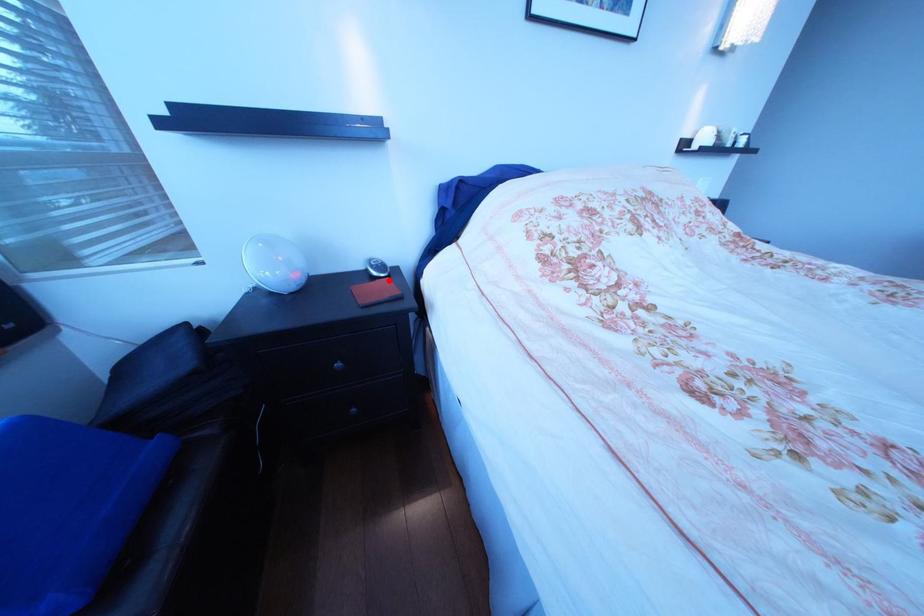
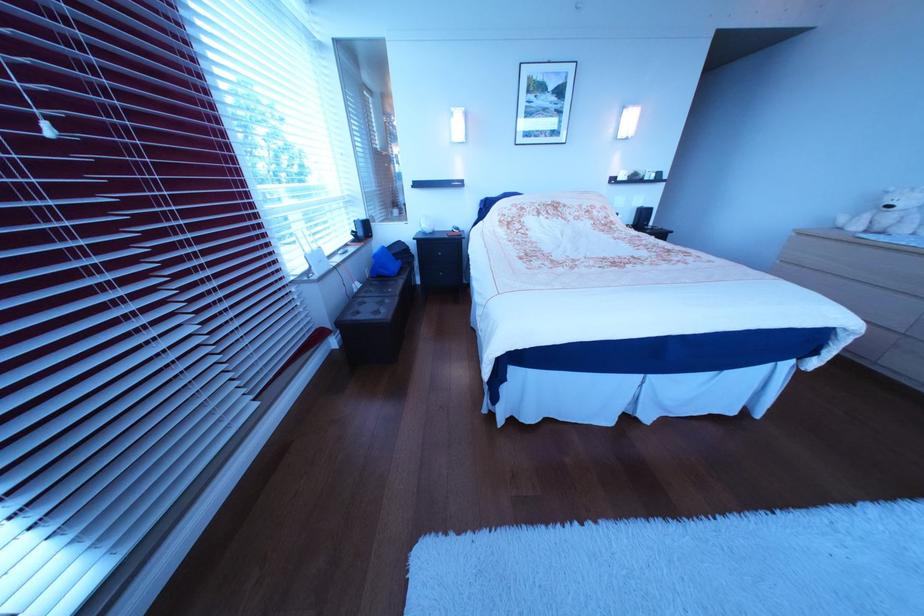
Question: I am providing you with two images of the same scene from different viewpoints. A red point is marked on the first image. Can you still see the location of the red point in image 2?

Choices:
 (A) Yes
 (B) No

Answer: (B)